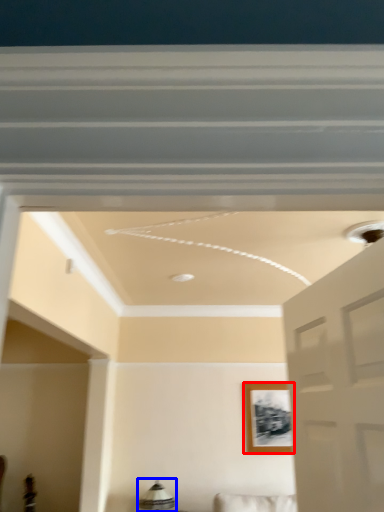
Question: Which point is closer to the camera, picture frame (highlighted by a red box) or lamp (highlighted by a blue box)?

Choices:
 (A) picture frame
 (B) lamp

Answer: (B)